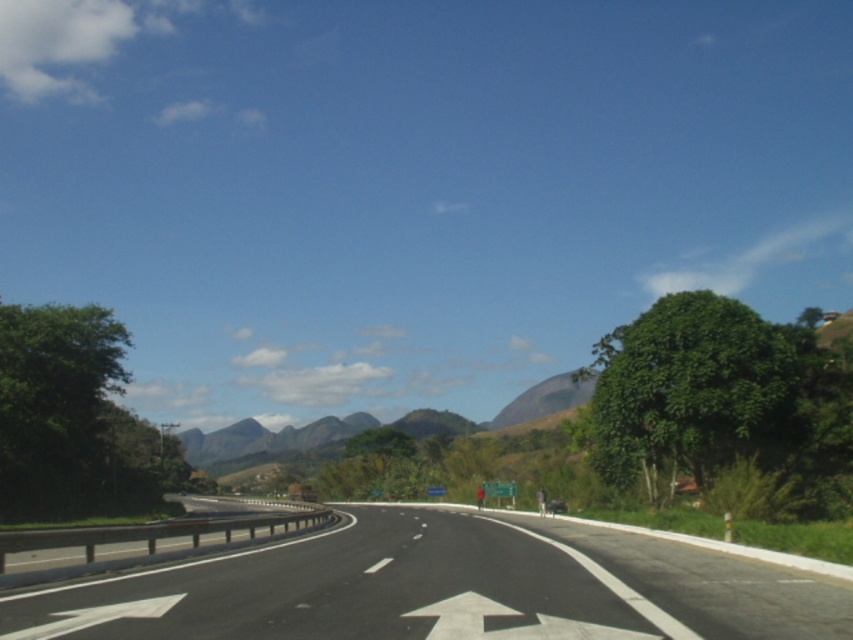
You are a drone operator planning to take a photo of the black asphalt road at center. The camera has a focal point at coordinates 0.5, 0.5. Will the road be centered in the photo?

The black asphalt road at center is located at point (444, 588), which is slightly off the center coordinates of (426, 320). Therefore, the road will not be perfectly centered in the photo.

You are standing at the point with coordinates [444,588] in the image. What object are you standing on?

You are standing on the black asphalt road at center.

You are driving a car with a width of 1.8 meters. You need to stay within the black asphalt road at center while passing through the white glossy arrow at center. Can your car fit on the road without crossing the lane markings?

The black asphalt road at center is wider than the white glossy arrow at center. Since the road is wider, your car with a width of 1.8 meters can fit on the road without crossing the lane markings as long as you stay within the marked lanes.